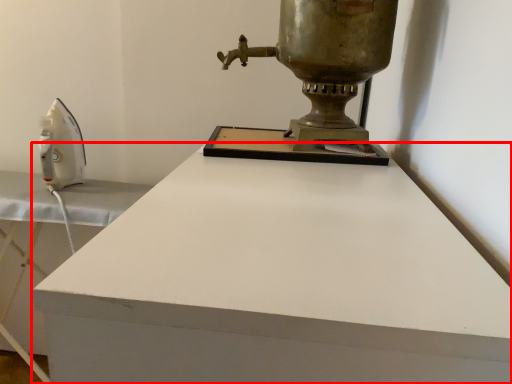
Question: Considering the relative positions of desk (annotated by the red box) and sewing machine in the image provided, where is desk (annotated by the red box) located with respect to the staircase?

Choices:
 (A) left
 (B) right

Answer: (A)